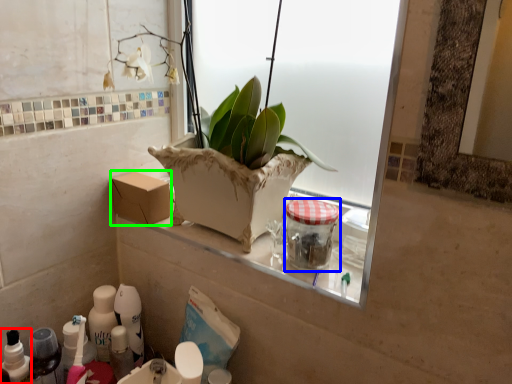
Question: Considering the real-world distances, which object is closest to toiletry (highlighted by a red box)? glass jar (highlighted by a blue box) or cardboard box (highlighted by a green box).

Choices:
 (A) glass jar
 (B) cardboard box

Answer: (B)